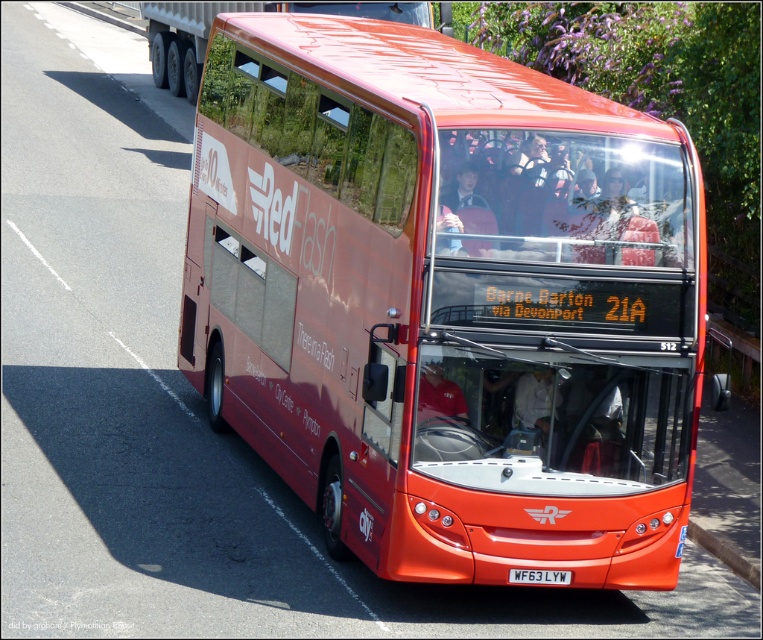
Is concrete at lower right shorter than white plastic license plate at center?

No.

Find the location of a particular element. This screenshot has width=763, height=640. concrete at lower right is located at coordinates (726, 552).

Does point (710, 544) come farther from viewer compared to point (557, 582)?

Yes.

Image resolution: width=763 pixels, height=640 pixels. What are the coordinates of `concrete at lower right` in the screenshot? It's located at [x=726, y=552].

Between shiny red bus at center and concrete at lower right, which one has more height?

Standing taller between the two is shiny red bus at center.

Can you confirm if shiny red bus at center is shorter than concrete at lower right?

In fact, shiny red bus at center may be taller than concrete at lower right.

You are a GUI agent. You are given a task and a screenshot of the screen. Output one action in this format:
    pyautogui.click(x=<x>, y=<y>)
    Task: Click on the shiny red bus at center
    
    Given the screenshot: What is the action you would take?
    pos(446,300)

Which of these two, shiny red bus at center or white plastic license plate at center, stands shorter?

With less height is white plastic license plate at center.

Is shiny red bus at center smaller than white plastic license plate at center?

No, shiny red bus at center is not smaller than white plastic license plate at center.

Which is behind, point (533, 252) or point (533, 580)?

Point (533, 580)

This screenshot has width=763, height=640. What are the coordinates of `shiny red bus at center` in the screenshot? It's located at click(x=446, y=300).